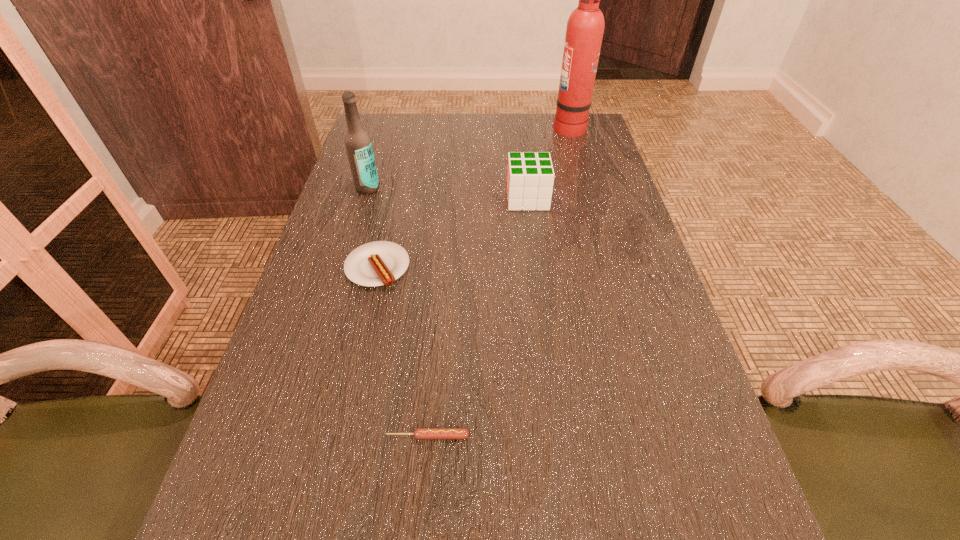
Locate an element on the screen. The image size is (960, 540). free space between the shorter sausage and the second tallest object is located at coordinates (397, 312).

Identify the location of free space between the third tallest object and the shortest object. The width and height of the screenshot is (960, 540). (478, 317).

You are a GUI agent. You are given a task and a screenshot of the screen. Output one action in this format:
    pyautogui.click(x=<x>, y=<y>)
    Task: Click on the vacant region between the second nearest object and the tallest object
    The width and height of the screenshot is (960, 540).
    Given the screenshot: What is the action you would take?
    pyautogui.click(x=473, y=197)

Locate an element on the screen. The height and width of the screenshot is (540, 960). vacant region between the second object from right to left and the right sausage is located at coordinates (478, 317).

Find the location of `empty space that is in between the taller sausage and the fourth object from left to right`. empty space that is in between the taller sausage and the fourth object from left to right is located at coordinates [x=452, y=233].

Find the location of a particular element. The image size is (960, 540). free space between the shortest object and the rightmost object is located at coordinates (498, 281).

You are a GUI agent. You are given a task and a screenshot of the screen. Output one action in this format:
    pyautogui.click(x=<x>, y=<y>)
    Task: Click on the vacant area that lies between the fourth shortest object and the fire extinguisher
    
    Given the screenshot: What is the action you would take?
    pyautogui.click(x=468, y=157)

Identify the location of object that can be found as the fourth closest to the farther sausage. (585, 27).

Point out which object is positioned as the nearest to the beer bottle. Please provide its 2D coordinates. Your answer should be formatted as a tuple, i.e. [(x, y)], where the tuple contains the x and y coordinates of a point satisfying the conditions above.

[(378, 263)]

The image size is (960, 540). What are the coordinates of `free point that satisfies the following two spatial constraints: 1. on the red face of the third shortest object; 2. on the front side of the shortest object` in the screenshot? It's located at (558, 436).